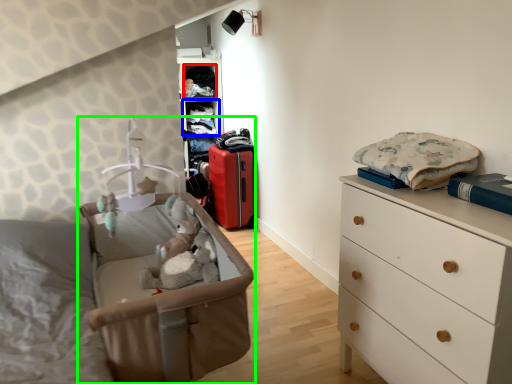
Question: Which object is the farthest from clothing (highlighted by a red box)? Choose among these: shelf (highlighted by a blue box) or infant bed (highlighted by a green box).

Choices:
 (A) shelf
 (B) infant bed

Answer: (B)